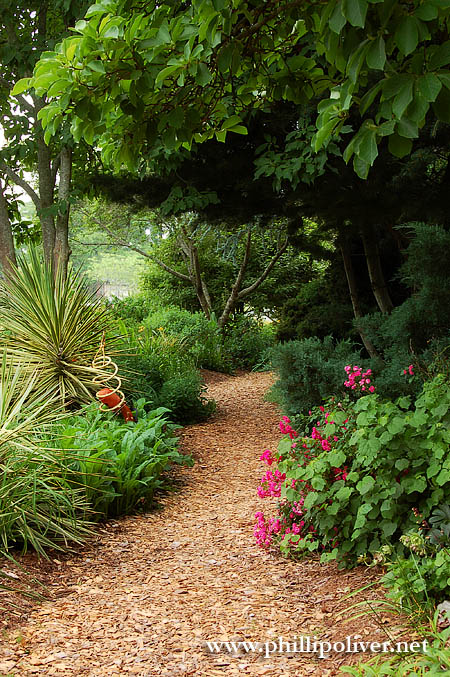
Find the location of `hanging ornament`. hanging ornament is located at coordinates (113, 393).